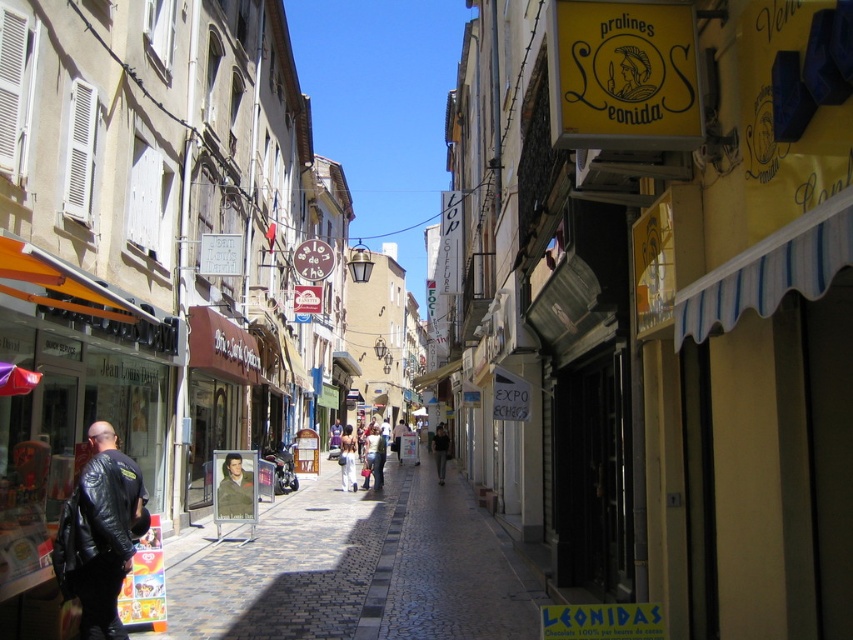
Between light blue jeans at center and dark gray sweater at center, which one is positioned higher?

Positioned higher is light blue jeans at center.

How far apart are light blue jeans at center and dark gray sweater at center?

light blue jeans at center is 5.07 meters away from dark gray sweater at center.

Is point (352, 474) positioned after point (433, 454)?

No, it is in front of (433, 454).

I want to click on light blue jeans at center, so click(347, 458).

Looking at this image, can you confirm if light brown leather jacket at center is thinner than dark gray sweater at center?

No, light brown leather jacket at center is not thinner than dark gray sweater at center.

Between light brown leather jacket at center and dark gray sweater at center, which one has more height?

dark gray sweater at center is taller.

Does point (364, 445) come in front of point (434, 452)?

No, (364, 445) is behind (434, 452).

What are the coordinates of `light brown leather jacket at center` in the screenshot? It's located at pos(375,454).

Where is `black leather jacket at lower left`? The image size is (853, 640). black leather jacket at lower left is located at coordinates (100, 532).

Which is below, black leather jacket at lower left or light brown leather jacket at center?

light brown leather jacket at center is lower down.

Who is more forward, (128, 564) or (381, 454)?

Point (128, 564) is more forward.

The height and width of the screenshot is (640, 853). I want to click on black leather jacket at lower left, so coord(100,532).